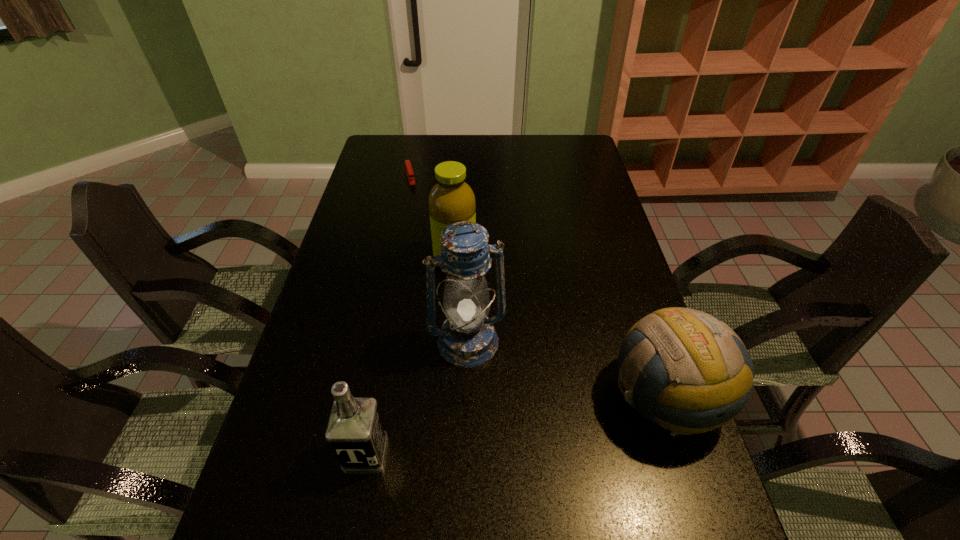
The height and width of the screenshot is (540, 960). Identify the location of blank space at the far edge of the desktop. (462, 140).

This screenshot has width=960, height=540. In the image, there is a desktop. Find the location of `free region at the left edge`. free region at the left edge is located at coordinates (376, 186).

Identify the location of free space at the right edge of the desktop. The height and width of the screenshot is (540, 960). (590, 316).

This screenshot has width=960, height=540. Identify the location of free location at the near left corner. (296, 489).

Where is `free space at the far right corner`? free space at the far right corner is located at coordinates (582, 136).

At what (x,y) coordinates should I click in order to perform the action: click on free space between the rightmost object and the shortest object. Please return your answer as a coordinate pair (x, y). Looking at the image, I should click on (538, 286).

The image size is (960, 540). In order to click on free space between the lantern and the rightmost object in this screenshot , I will do `click(567, 369)`.

Identify the location of free space between the farthest object and the vodka. tap(388, 315).

This screenshot has height=540, width=960. What are the coordinates of `empty location between the vodka and the second tallest object` in the screenshot? It's located at (411, 357).

The height and width of the screenshot is (540, 960). What are the coordinates of `vacant space that is in between the rightmost object and the tallest object` in the screenshot? It's located at (567, 369).